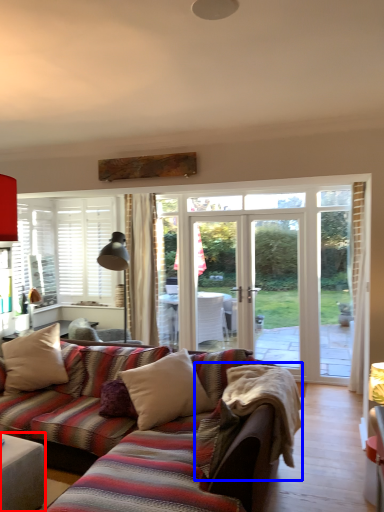
Question: Which object is closer to the camera taking this photo, table (highlighted by a red box) or blanket (highlighted by a blue box)?

Choices:
 (A) table
 (B) blanket

Answer: (A)